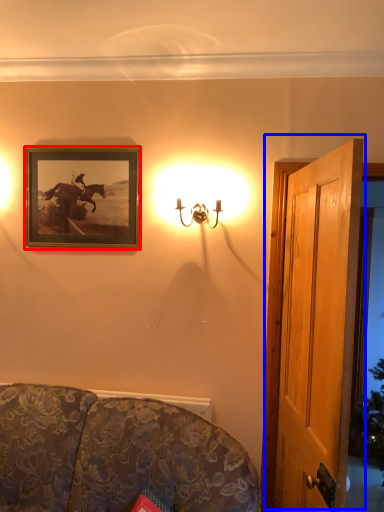
Question: Which object appears farthest to the camera in this image, picture frame (highlighted by a red box) or door (highlighted by a blue box)?

Choices:
 (A) picture frame
 (B) door

Answer: (A)